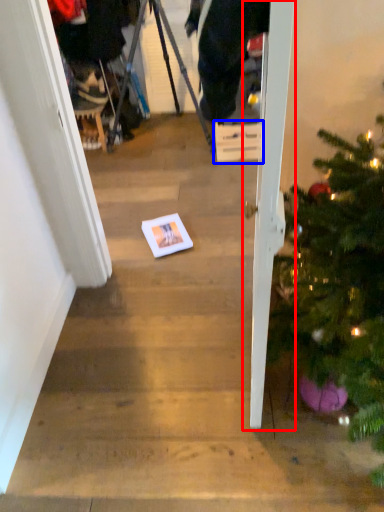
Question: Which object appears closest to the camera in this image, door (highlighted by a red box) or cardboard box (highlighted by a blue box)?

Choices:
 (A) door
 (B) cardboard box

Answer: (A)